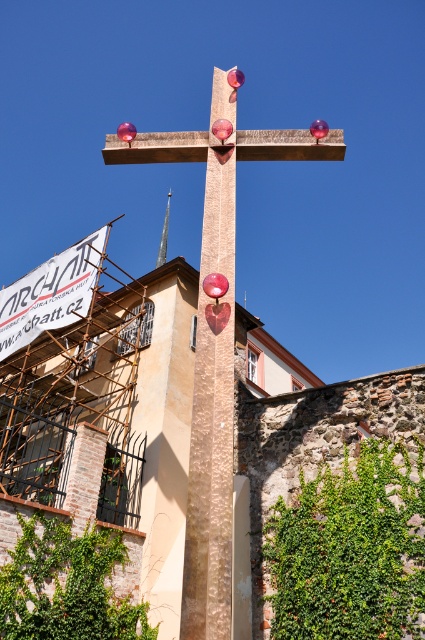
You are an architect evaluating the proportions of the scene. Given that the wooden cross at center and the silver metallic spire at center are both central elements, which one appears bigger to someone standing directly in front of them?

The wooden cross at center is larger in size than the silver metallic spire at center, so the wooden cross at center would appear bigger to someone standing directly in front of them.

You are standing in front of the cross structure and looking towards the building under renovation. There are two points marked on the cross structure. One is at point (220, 365) and the other is at point (166, 240). Which point is closer to you?

Point (220, 365) is in front of point (166, 240), so it is closer to you.